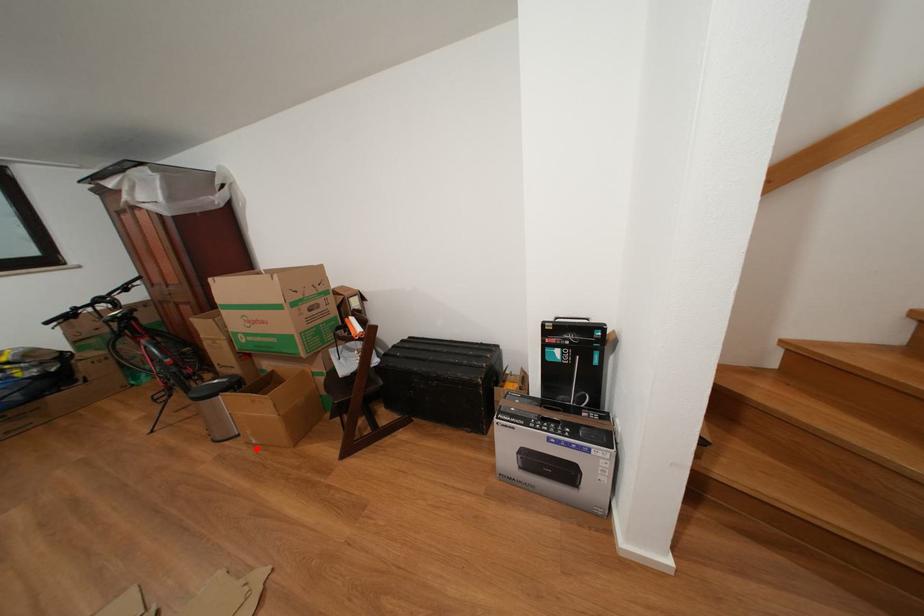
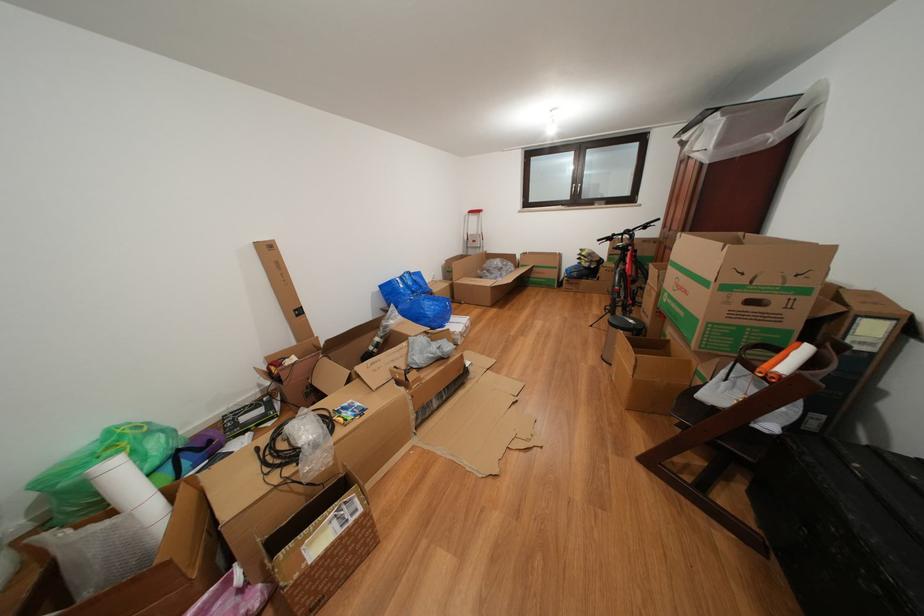
Locate, in the second image, the point that corresponds to the highlighted location in the first image.

(619, 382)